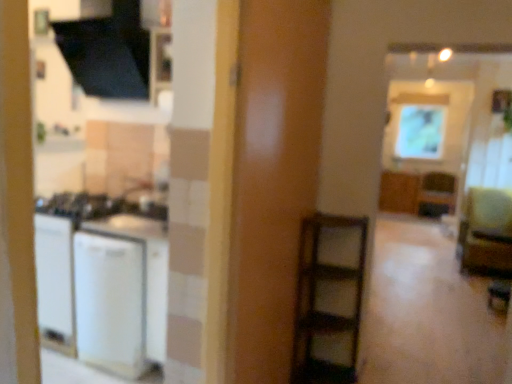
Question: Can you confirm if white matte refrigerator at left is smaller than matte glass window screen at upper right?

Choices:
 (A) yes
 (B) no

Answer: (B)

Question: Can you confirm if white matte refrigerator at left is positioned to the left of matte glass window screen at upper right?

Choices:
 (A) no
 (B) yes

Answer: (B)

Question: Is matte glass window screen at upper right located within white matte refrigerator at left?

Choices:
 (A) yes
 (B) no

Answer: (B)

Question: Is white matte refrigerator at left far from matte glass window screen at upper right?

Choices:
 (A) no
 (B) yes

Answer: (B)

Question: Does white matte refrigerator at left turn towards matte glass window screen at upper right?

Choices:
 (A) no
 (B) yes

Answer: (A)

Question: From the image's perspective, is white matte refrigerator at left above matte glass window screen at upper right?

Choices:
 (A) no
 (B) yes

Answer: (A)

Question: From a real-world perspective, is green fabric armchair at right positioned under wooden cabinet at upper right, the first cabinetry from the left, based on gravity?

Choices:
 (A) yes
 (B) no

Answer: (B)

Question: From the image's perspective, does green fabric armchair at right appear higher than wooden cabinet at upper right, the first cabinetry from the left?

Choices:
 (A) yes
 (B) no

Answer: (B)

Question: Is green fabric armchair at right at the left side of wooden cabinet at upper right, the first cabinetry from the left?

Choices:
 (A) yes
 (B) no

Answer: (B)

Question: From a real-world perspective, does green fabric armchair at right stand above wooden cabinet at upper right, the second cabinetry in the right-to-left sequence?

Choices:
 (A) yes
 (B) no

Answer: (A)

Question: Is green fabric armchair at right far from wooden cabinet at upper right, the second cabinetry in the right-to-left sequence?

Choices:
 (A) yes
 (B) no

Answer: (A)

Question: Is green fabric armchair at right further to the viewer compared to wooden cabinet at upper right, the first cabinetry from the left?

Choices:
 (A) yes
 (B) no

Answer: (B)

Question: From the image's perspective, is wooden cabinet at center-right, which ranks as the second cabinetry in left-to-right order, below matte brown screen door at center?

Choices:
 (A) yes
 (B) no

Answer: (B)